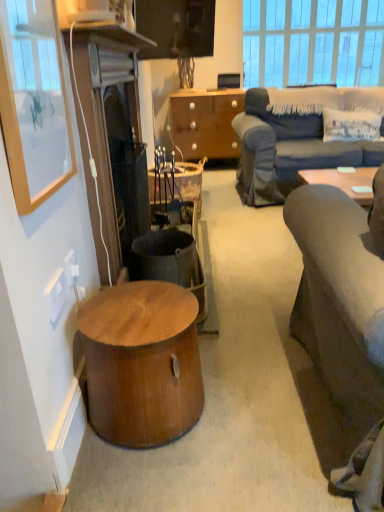
Locate an element on the screen. vacant space to the right of wooden round stool at lower left is located at coordinates [x=250, y=405].